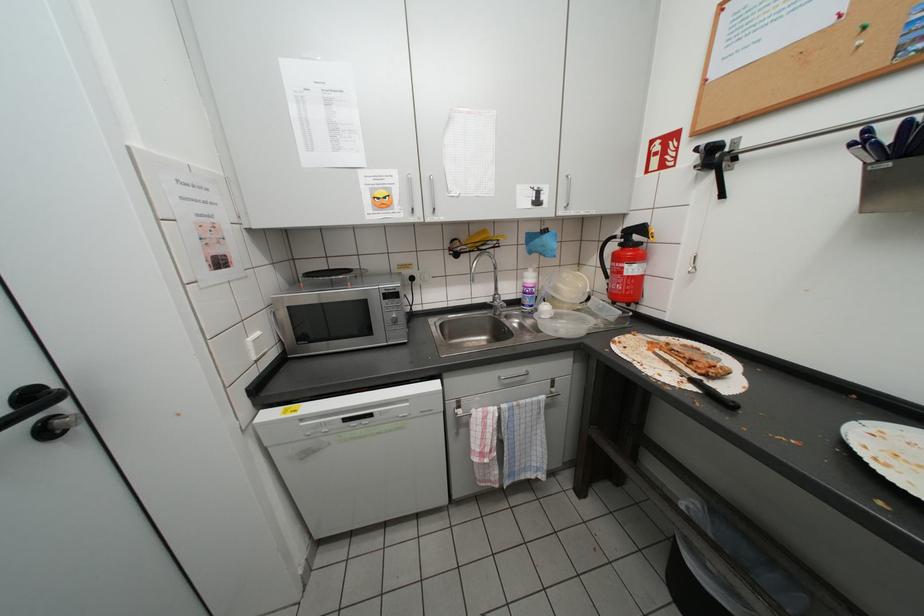
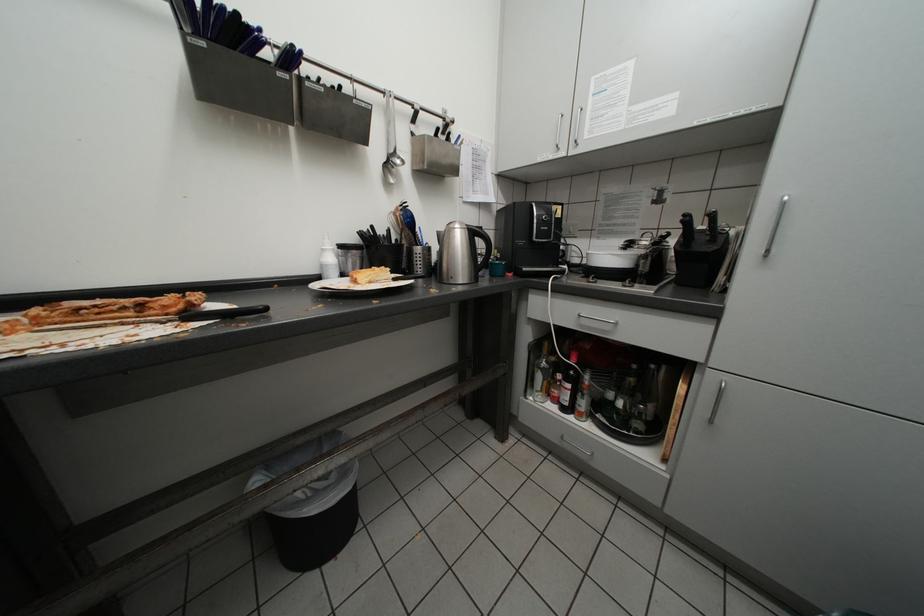
Based on the continuous images, in which direction is the camera rotating?

The camera's rotation is toward right-down.